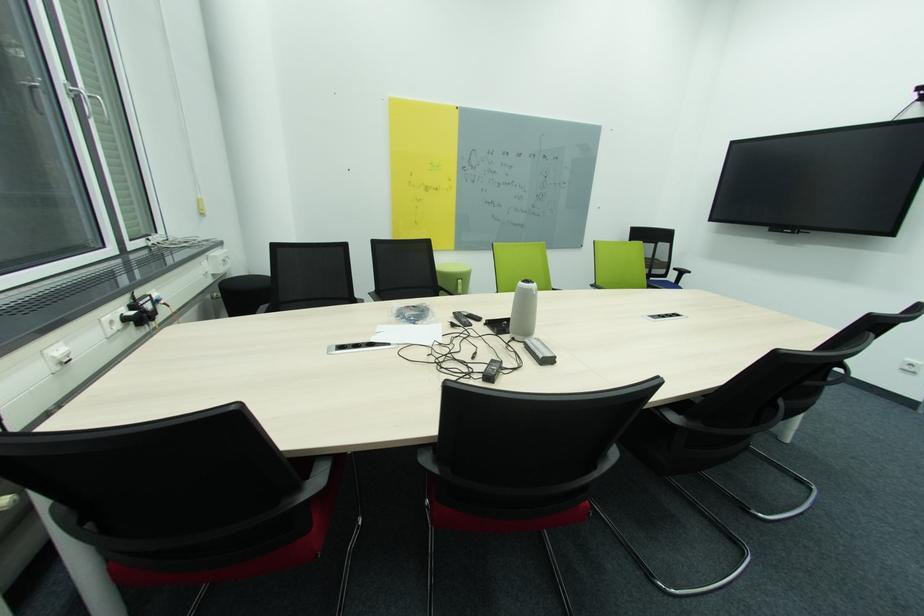
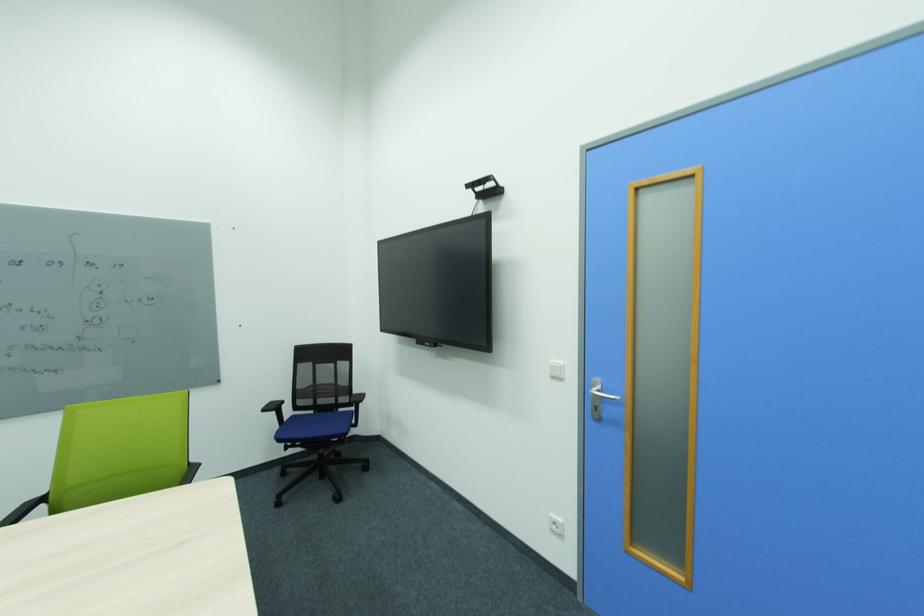
Locate, in the second image, the point that corresponds to (677,267) in the first image.

(360, 392)